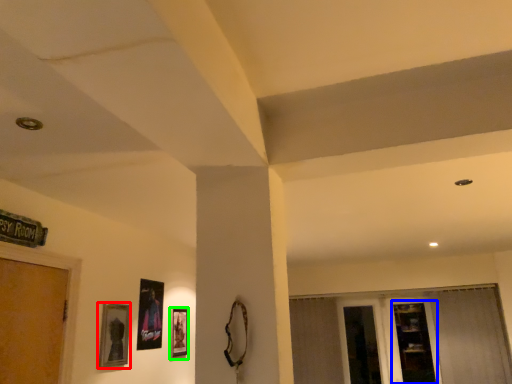
Question: Considering the real-world distances, which object is closest to picture frame (highlighted by a red box)? shelf (highlighted by a blue box) or picture frame (highlighted by a green box).

Choices:
 (A) shelf
 (B) picture frame

Answer: (B)